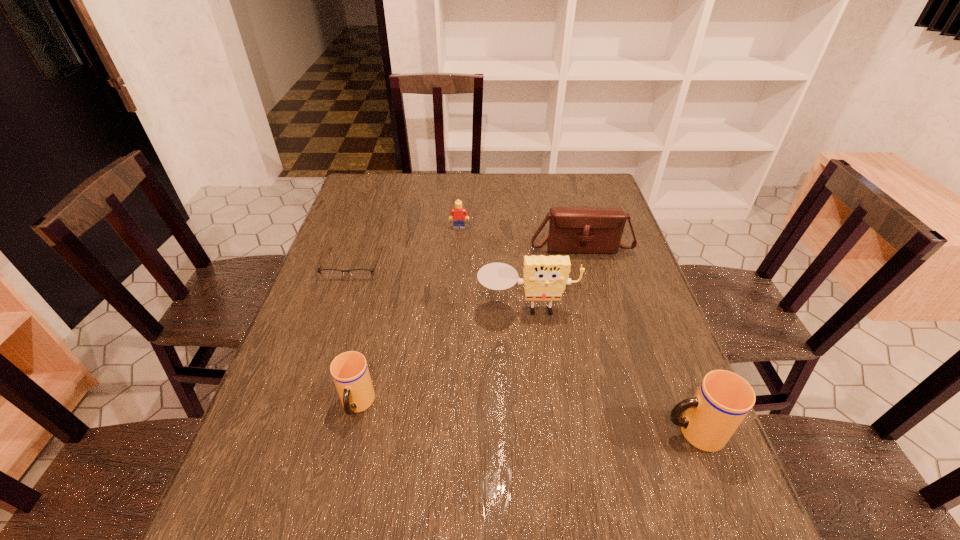
Find the location of a particular element. The width and height of the screenshot is (960, 540). free space that satisfies the following two spatial constraints: 1. on the front-facing side of the farthest object; 2. on the side of the taller cup with the handle is located at coordinates 447,432.

Where is `vacant area in the image that satisfies the following two spatial constraints: 1. on the side of the left cup with the handle; 2. on the side of the taller cup with the handle`? This screenshot has width=960, height=540. vacant area in the image that satisfies the following two spatial constraints: 1. on the side of the left cup with the handle; 2. on the side of the taller cup with the handle is located at coordinates (351, 432).

Image resolution: width=960 pixels, height=540 pixels. In order to click on free location that satisfies the following two spatial constraints: 1. on the side of the shorter cup with the handle; 2. on the side of the right cup with the handle in this screenshot , I will do `click(351, 432)`.